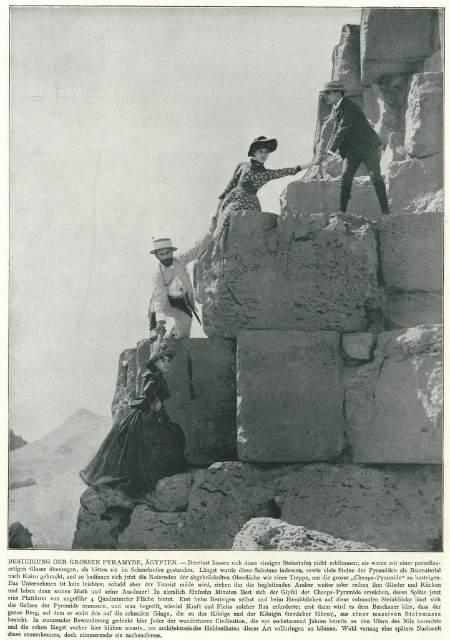
You are a photographer aiming to capture a detailed shot of both the matte black dress at lower left and the dotted fabric dress at center. Since the dresses are at different positions, you need to adjust your camera focus. Which dress requires a closer focus to ensure clarity?

The matte black dress at lower left requires closer focus because it is positioned closer to the camera than the dotted fabric dress at center.

You are a photographer standing at the base of the Great Pyramid of Giza and notice the matte black dress at lower left. If you want to capture a closeup shot of this dress, which direction should you aim your camera relative to the pyramid?

The matte black dress at lower left is located at point coordinates that are to the left side and lower portion of the image. To capture a closeup, aim your camera towards the lower left direction relative to the pyramid.

You are a photographer aiming to capture a photo of the two climbers wearing the matte black dress at lower left and the dotted fabric dress at center. Based on their positions, which climber is closer to the base of the Great Pyramid of Giza?

The matte black dress at lower left is located below the dotted fabric dress at center, so the climber wearing the matte black dress at lower left is closer to the base of the Great Pyramid of Giza.